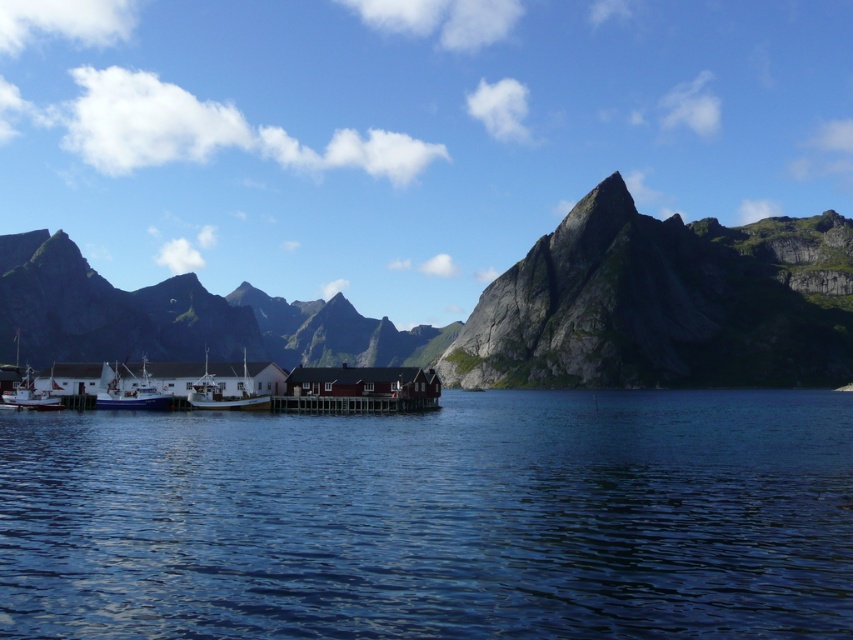
Question: Which object is positioned closest to the blue water at center?

Choices:
 (A) white wooden boat at lower left
 (B) rugged granite mountain at center
 (C) white matte boat at lower left

Answer: (C)

Question: Estimate the real-world distances between objects in this image. Which object is closer to the rugged granite mountain at center?

Choices:
 (A) white matte boat at center
 (B) blue water at center
 (C) white wooden boat at lower left
 (D) gray rocky mountain at center

Answer: (D)

Question: Can you confirm if rugged granite mountain at center is positioned below gray rocky mountain at center?

Choices:
 (A) no
 (B) yes

Answer: (A)

Question: Does rugged granite mountain at center appear on the right side of white wooden boat at lower left?

Choices:
 (A) no
 (B) yes

Answer: (B)

Question: Which object is farther from the camera taking this photo?

Choices:
 (A) gray rocky mountain at center
 (B) white wooden boat at lower left
 (C) white matte boat at center
 (D) blue water at center

Answer: (A)

Question: Does gray rocky mountain at center appear under white matte boat at lower left?

Choices:
 (A) yes
 (B) no

Answer: (B)